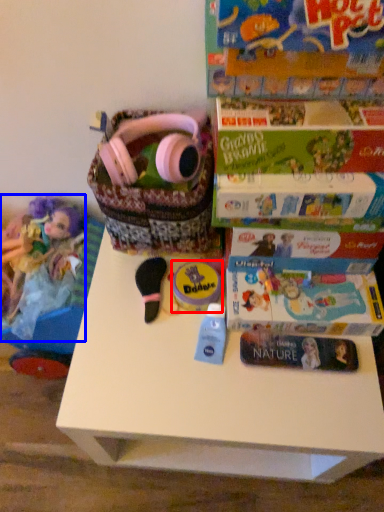
Question: Among these objects, which one is farthest to the camera, toy (highlighted by a red box) or doll (highlighted by a blue box)?

Choices:
 (A) toy
 (B) doll

Answer: (B)